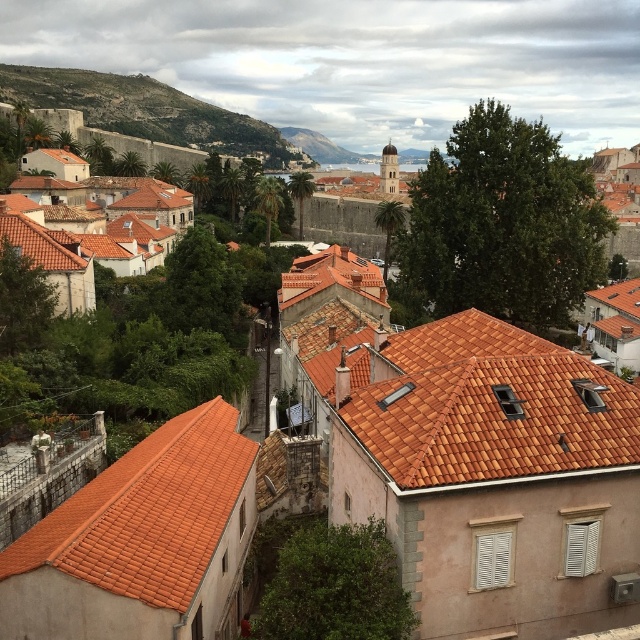
Is terracotta tile roof at lower left positioned in front of green grassy hillside at upper left?

Yes, terracotta tile roof at lower left is in front of green grassy hillside at upper left.

Who is positioned more to the right, terracotta tile roof at lower left or green grassy hillside at upper left?

terracotta tile roof at lower left is more to the right.

Identify the location of terracotta tile roof at lower left. The width and height of the screenshot is (640, 640). (147, 513).